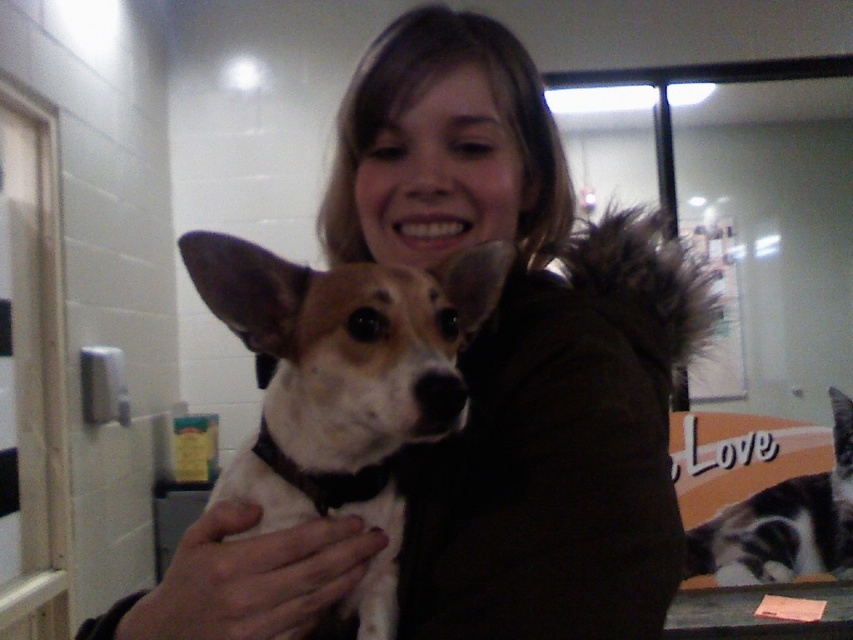
Who is positioned more to the right, white fur dog at center or gray and white fur cat at lower right?

gray and white fur cat at lower right is more to the right.

Based on the photo, who is shorter, white fur dog at center or gray and white fur cat at lower right?

Standing shorter between the two is white fur dog at center.

What do you see at coordinates (344, 384) in the screenshot? I see `white fur dog at center` at bounding box center [344, 384].

Identify the location of white fur dog at center. (344, 384).